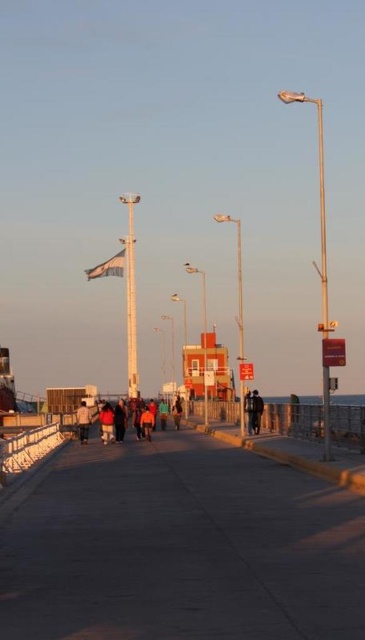
Which is more to the left, dark brown leather jacket at center or dark blue jeans at center?

dark brown leather jacket at center

Where is `dark brown leather jacket at center`? dark brown leather jacket at center is located at coordinates (106, 422).

Which is behind, point (102, 440) or point (177, 422)?

The point (177, 422) is more distant.

Where is `dark brown leather jacket at center`? dark brown leather jacket at center is located at coordinates (106, 422).

Does point (48, 508) lie behind point (251, 410)?

No, (48, 508) is in front of (251, 410).

Is point (144, 451) positioned in front of point (258, 422)?

Yes.

Where is `concrete sidewalk at center`? The image size is (365, 640). concrete sidewalk at center is located at coordinates (181, 547).

What are the coordinates of `concrete sidewalk at center` in the screenshot? It's located at (181, 547).

Does concrete sidewalk at center have a lesser height compared to dark blue jeans at center?

No.

Is point (236, 483) farther from viewer compared to point (177, 406)?

No, it is in front of (177, 406).

Is point (224, 484) farther from camera compared to point (173, 410)?

No, it is in front of (173, 410).

In order to click on concrete sidewalk at center in this screenshot , I will do `click(181, 547)`.